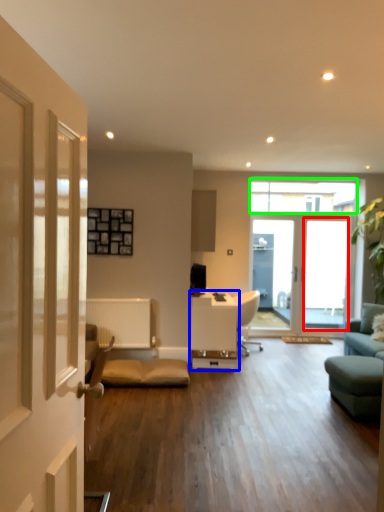
Question: Considering the real-world distances, which object is farthest from window screen (highlighted by a red box)? table (highlighted by a blue box) or window (highlighted by a green box)?

Choices:
 (A) table
 (B) window

Answer: (A)